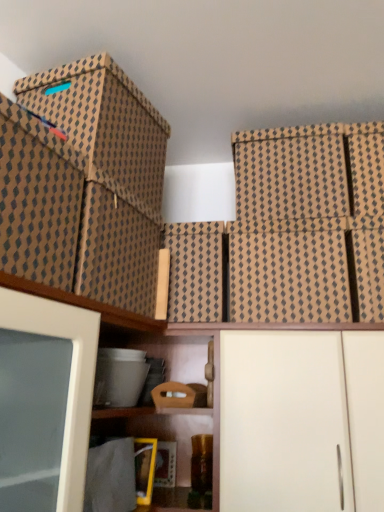
Question: Is brown textured box at upper right, acting as the 1th storage box starting from the right, wider than wooden box at center, the sixth storage box positioned from the right?

Choices:
 (A) yes
 (B) no

Answer: (A)

Question: Does brown textured box at upper right, placed as the 9th storage box when sorted from left to right, appear on the right side of wooden box at center, the sixth storage box positioned from the right?

Choices:
 (A) no
 (B) yes

Answer: (B)

Question: From the image's perspective, does brown textured box at upper right, acting as the 1th storage box starting from the right, appear higher than wooden box at center, which is the fourth storage box in left-to-right order?

Choices:
 (A) no
 (B) yes

Answer: (B)

Question: From the image's perspective, is brown textured box at upper right, placed as the 9th storage box when sorted from left to right, under wooden box at center, which is the fourth storage box in left-to-right order?

Choices:
 (A) yes
 (B) no

Answer: (B)

Question: From a real-world perspective, is brown textured box at upper right, placed as the 9th storage box when sorted from left to right, positioned under wooden box at center, the sixth storage box positioned from the right, based on gravity?

Choices:
 (A) no
 (B) yes

Answer: (A)

Question: Considering the positions of brown cardboard box at center, the fifth storage box positioned from the left, and white matte cabinet at lower center in the image, is brown cardboard box at center, the fifth storage box positioned from the left, taller or shorter than white matte cabinet at lower center?

Choices:
 (A) short
 (B) tall

Answer: (A)

Question: Is brown cardboard box at center, which is the fifth storage box from right to left, in front of or behind white matte cabinet at lower center in the image?

Choices:
 (A) front
 (B) behind

Answer: (B)

Question: From the image's perspective, relative to white matte cabinet at lower center, is brown cardboard box at center, the fifth storage box positioned from the left, above or below?

Choices:
 (A) below
 (B) above

Answer: (B)

Question: Is point (208, 240) positioned closer to the camera than point (382, 471)?

Choices:
 (A) farther
 (B) closer

Answer: (A)

Question: Looking at their shapes, would you say brown textured box at upper right, placed as the 9th storage box when sorted from left to right, is wider or thinner than brown textured box at upper right, the third storage box viewed from the right?

Choices:
 (A) wide
 (B) thin

Answer: (B)

Question: From a real-world perspective, is brown textured box at upper right, placed as the 9th storage box when sorted from left to right, above or below brown textured box at upper right, the third storage box viewed from the right?

Choices:
 (A) below
 (B) above

Answer: (B)

Question: Considering their positions, is brown textured box at upper right, acting as the 1th storage box starting from the right, located in front of or behind brown textured box at upper right, the third storage box viewed from the right?

Choices:
 (A) front
 (B) behind

Answer: (A)

Question: Is brown textured box at upper right, placed as the 9th storage box when sorted from left to right, to the left or to the right of brown textured box at upper right, the seventh storage box viewed from the left, in the image?

Choices:
 (A) right
 (B) left

Answer: (A)

Question: Is brown textured box at upper right, placed as the 9th storage box when sorted from left to right, inside or outside of brown textured box at center, which ranks as the sixth storage box in left-to-right order?

Choices:
 (A) inside
 (B) outside

Answer: (B)

Question: Considering the positions of point (370, 146) and point (228, 251), is point (370, 146) closer or farther from the camera than point (228, 251)?

Choices:
 (A) farther
 (B) closer

Answer: (A)